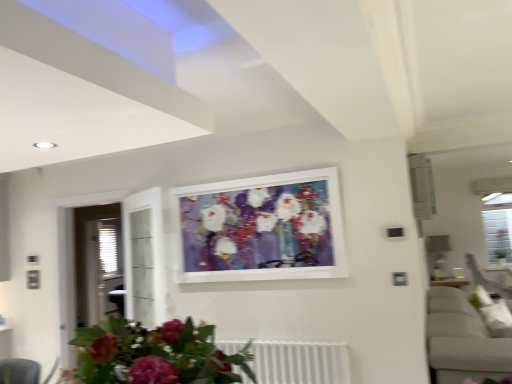
Question: From the image's perspective, relative to white metallic radiator at lower center, is matte pink flowers at lower center above or below?

Choices:
 (A) above
 (B) below

Answer: (A)

Question: From a real-world perspective, is matte pink flowers at lower center positioned above or below white metallic radiator at lower center?

Choices:
 (A) below
 (B) above

Answer: (B)

Question: Which is nearer to the white metallic radiator at lower center?

Choices:
 (A) matte pink flowers at lower center
 (B) matte white picture frame at center

Answer: (B)

Question: Based on their relative distances, which object is nearer to the matte white picture frame at center?

Choices:
 (A) matte pink flowers at lower center
 (B) white metallic radiator at lower center

Answer: (B)